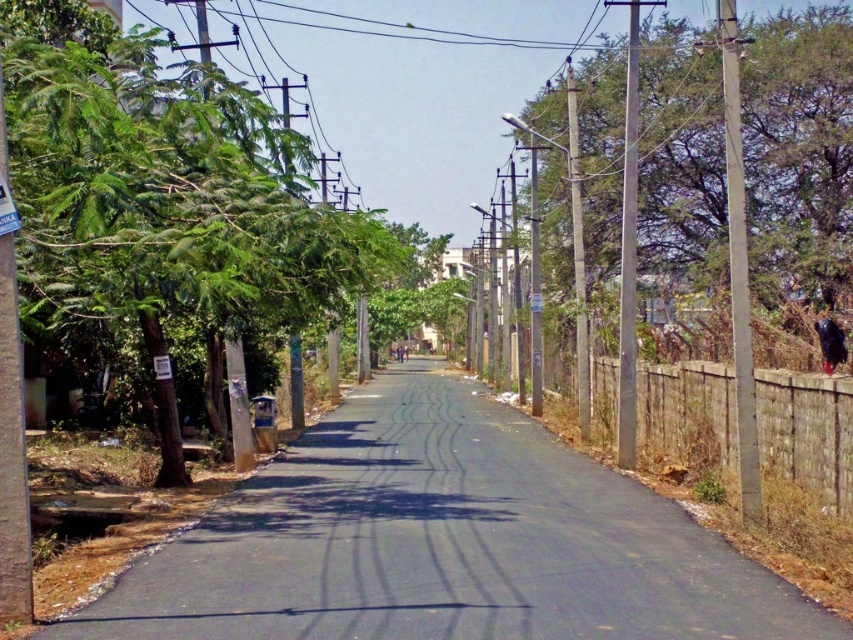
Who is more forward, (845, 212) or (608, 413)?

Point (608, 413) is in front.

Can you confirm if green leafy tree at right is thinner than brown wooden fence at right?

In fact, green leafy tree at right might be wider than brown wooden fence at right.

Where is `green leafy tree at right`? green leafy tree at right is located at coordinates (798, 147).

Find the location of a particular element. green leafy tree at right is located at coordinates (798, 147).

Can you confirm if green leafy tree at left is smaller than green leafy tree at right?

Indeed, green leafy tree at left has a smaller size compared to green leafy tree at right.

Can you confirm if green leafy tree at left is positioned below green leafy tree at right?

Yes.

Identify the location of green leafy tree at left. The width and height of the screenshot is (853, 640). (164, 189).

Can you confirm if black asphalt road at center is positioned above green leafy tree at left?

No, black asphalt road at center is not above green leafy tree at left.

Is point (426, 568) closer to camera compared to point (341, 236)?

That is True.

I want to click on black asphalt road at center, so click(444, 541).